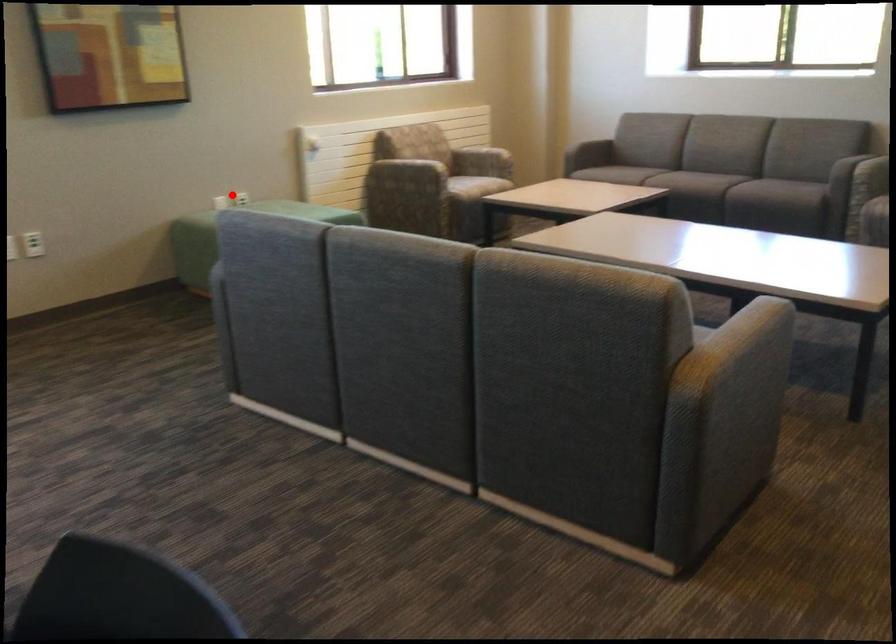
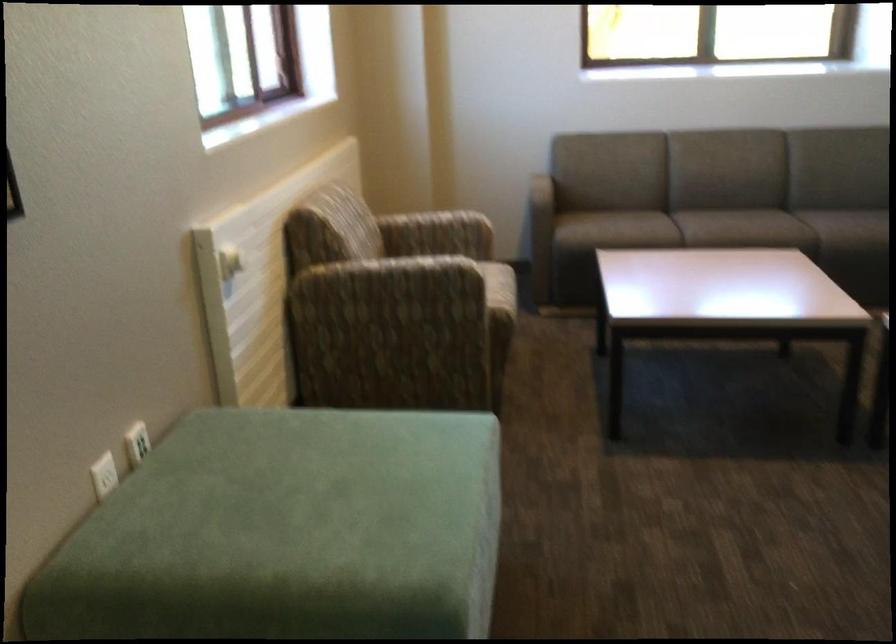
Question: I am providing you with two images of the same scene from different viewpoints. Image1 has a red point marked. In image2, the corresponding 3D location appears at what relative position? Reply with the corresponding letter.

Choices:
 (A) Closer
 (B) Farther

Answer: (A)